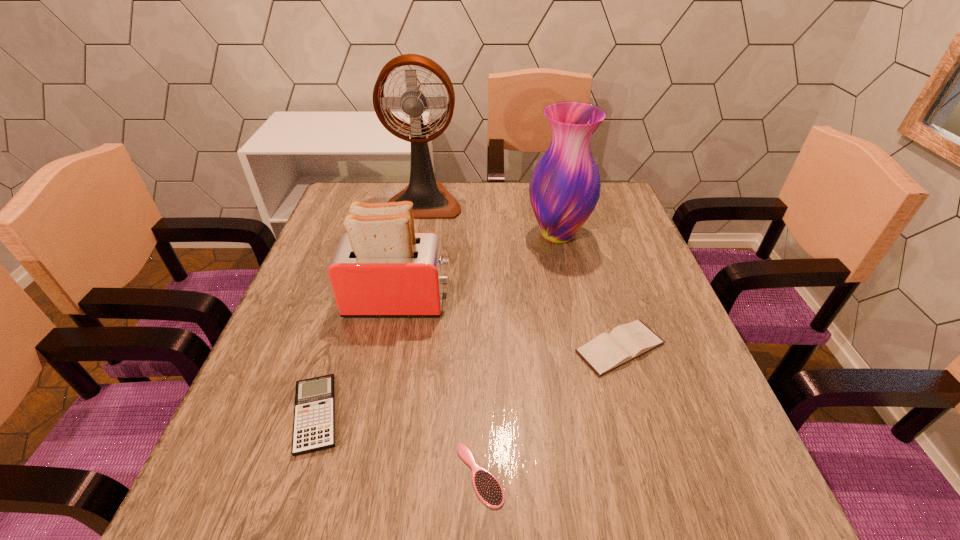
Where is `free space between the third object from right to left and the third nearest object`? free space between the third object from right to left and the third nearest object is located at coordinates (550, 411).

Image resolution: width=960 pixels, height=540 pixels. I want to click on empty space between the vase and the fan, so click(491, 218).

The height and width of the screenshot is (540, 960). Find the location of `free space between the fourth farthest object and the third object from right to left`. free space between the fourth farthest object and the third object from right to left is located at coordinates (550, 411).

At what (x,y) coordinates should I click in order to perform the action: click on vacant area that lies between the fourth object from left to right and the fourth shortest object. Please return your answer as a coordinate pair (x, y). The height and width of the screenshot is (540, 960). Looking at the image, I should click on (440, 388).

Identify the location of vacant space in between the vase and the third tallest object. (478, 267).

Locate an element on the screen. vacant point located between the calculator and the diary is located at coordinates (468, 381).

Where is `object that is the closest one to the third object from right to left`? The image size is (960, 540). object that is the closest one to the third object from right to left is located at coordinates (314, 412).

At what (x,y) coordinates should I click in order to perform the action: click on object that is the second closest to the hairbrush. Please return your answer as a coordinate pair (x, y). Looking at the image, I should click on (624, 343).

Where is `vacant space that satisfies the following two spatial constraints: 1. on the front-facing side of the tallest object; 2. on the front-facing side of the toaster`? The height and width of the screenshot is (540, 960). vacant space that satisfies the following two spatial constraints: 1. on the front-facing side of the tallest object; 2. on the front-facing side of the toaster is located at coordinates (405, 301).

What are the coordinates of `vacant space that satisfies the following two spatial constraints: 1. on the front-facing side of the tallest object; 2. on the front-facing side of the third farthest object` in the screenshot? It's located at [x=405, y=301].